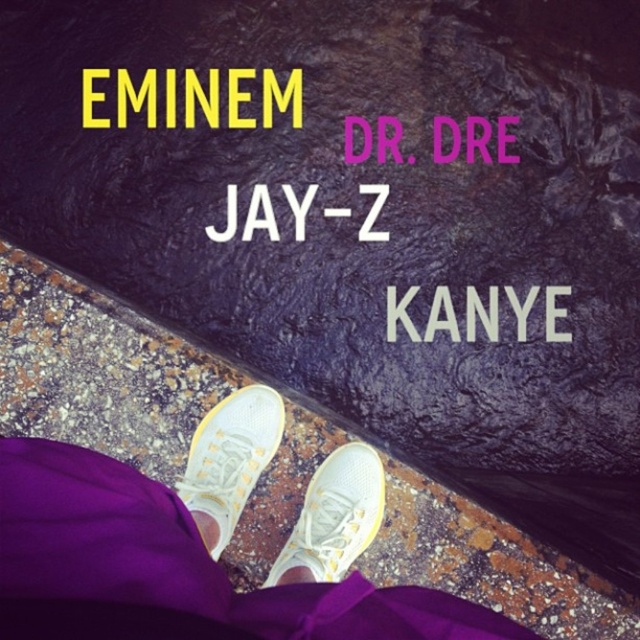
Question: Can you confirm if pink matte text at center is wider than white matte text at center?

Choices:
 (A) no
 (B) yes

Answer: (A)

Question: Does white canvas sneakers at center appear on the left side of pink matte text at center?

Choices:
 (A) yes
 (B) no

Answer: (A)

Question: Which is nearer to the pink matte text at center?

Choices:
 (A) yellow metallic text at upper center
 (B) white mesh sneakers at center
 (C) white mesh shoe at center
 (D) white canvas sneakers at center

Answer: (A)

Question: Which object is positioned closest to the white mesh shoe at center?

Choices:
 (A) white canvas sneakers at center
 (B) white mesh sneakers at center
 (C) white matte text at center
 (D) white textured stone at center

Answer: (A)

Question: Observing the image, what is the correct spatial positioning of white textured stone at center in reference to white matte text at center?

Choices:
 (A) left
 (B) right

Answer: (B)

Question: Which of these objects is positioned closest to the white mesh shoe at center?

Choices:
 (A) yellow metallic text at upper center
 (B) pink matte text at center

Answer: (B)